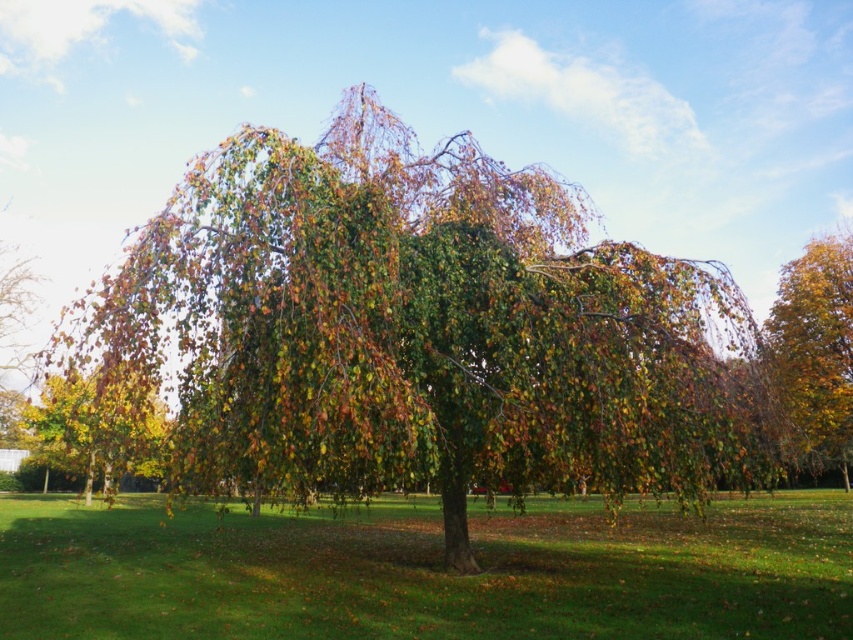
In the scene shown: How far apart are green grass at center and yellow-green leaves at lower left?

green grass at center and yellow-green leaves at lower left are 9.71 meters apart.

Is green grass at center below yellow-green leaves at lower left?

Yes.

The width and height of the screenshot is (853, 640). I want to click on green grass at center, so pyautogui.click(x=428, y=573).

Can you confirm if yellow-green leaves at right is smaller than yellow-green leaves at lower left?

Yes.

What do you see at coordinates (815, 344) in the screenshot? I see `yellow-green leaves at right` at bounding box center [815, 344].

Does point (810, 422) come farther from viewer compared to point (68, 460)?

No.

You are a GUI agent. You are given a task and a screenshot of the screen. Output one action in this format:
    pyautogui.click(x=<x>, y=<y>)
    Task: Click on the yellow-green leaves at right
    The image size is (853, 640).
    Given the screenshot: What is the action you would take?
    click(x=815, y=344)

Does green leafy tree at center appear on the left side of yellow-green leaves at right?

Correct, you'll find green leafy tree at center to the left of yellow-green leaves at right.

Can you confirm if green leafy tree at center is thinner than yellow-green leaves at right?

Incorrect, green leafy tree at center's width is not less than yellow-green leaves at right's.

You are a GUI agent. You are given a task and a screenshot of the screen. Output one action in this format:
    pyautogui.click(x=<x>, y=<y>)
    Task: Click on the green leafy tree at center
    This screenshot has width=853, height=640.
    Given the screenshot: What is the action you would take?
    pyautogui.click(x=410, y=333)